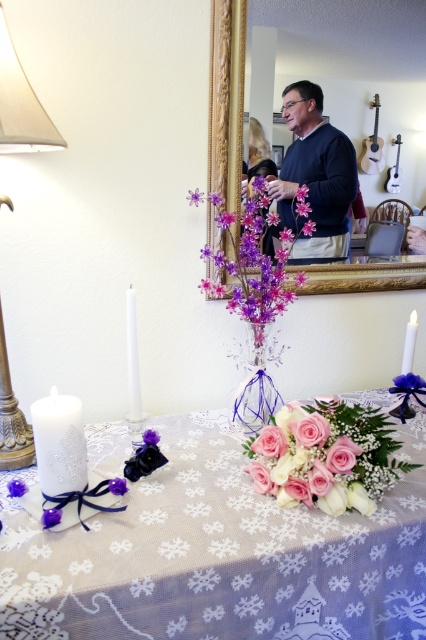
Is point (215, 124) less distant than point (120, 493)?

No, it is not.

Which is in front, point (209, 204) or point (111, 484)?

Point (111, 484)

Locate an element on the screen. gold-framed mirror at upper center is located at coordinates (226, 97).

Between white wax candle at lower left and white matte candle at right, which one appears on the left side from the viewer's perspective?

white wax candle at lower left is more to the left.

Between white wax candle at lower left and white matte candle at right, which one appears on the right side from the viewer's perspective?

white matte candle at right is more to the right.

Between point (137, 417) and point (409, 323), which one is positioned behind?

The point (409, 323) is more distant.

Where is `white wax candle at lower left`? This screenshot has width=426, height=640. white wax candle at lower left is located at coordinates (132, 358).

Who is more distant from viewer, (0, 200) or (52, 467)?

The point (0, 200) is behind.

Is matte gold lamp at left above white glossy candle at lower left?

Yes.

Is point (22, 417) in front of point (43, 468)?

That is False.

Locate an element on the screen. matte gold lamp at left is located at coordinates (20, 106).